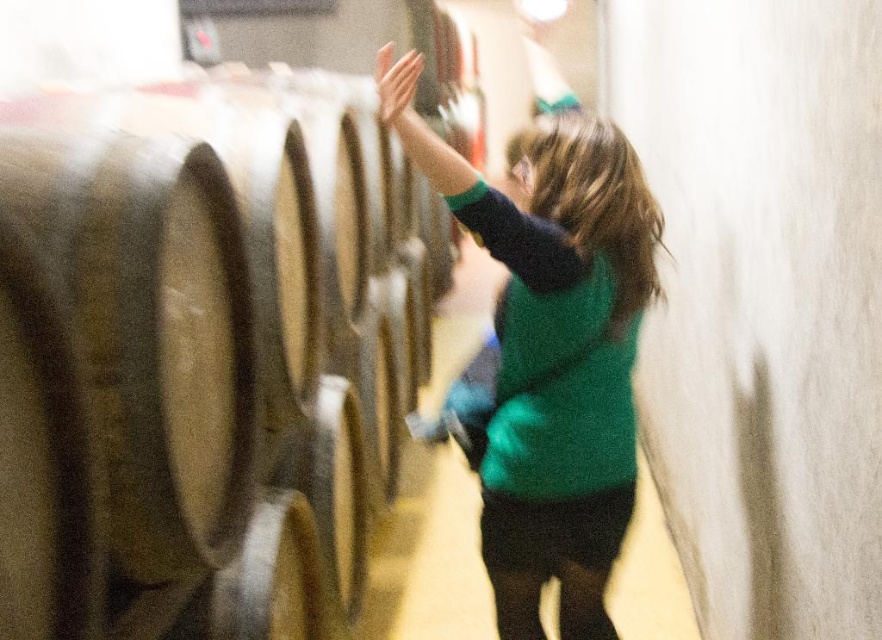
You are standing in a winery and see the smooth wood barrel at left and the green knitted sweater at center. Which object is positioned to the left of the other?

The smooth wood barrel at left is to the left of the green knitted sweater at center.

You are a tour guide explaining the winery to visitors. You point out the smooth wood barrel at left and the green knitted sweater at center. Which object is bigger in size?

The smooth wood barrel at left is larger in size than the green knitted sweater at center.

You are standing at point (520, 317) in the winery scene. There is a point (319, 280) behind you. Can you see the girl touching the barrels from your current position?

Point (319, 280) is behind point (520, 317), so you cannot see the girl touching the barrels from your current position because the girl is located behind you.